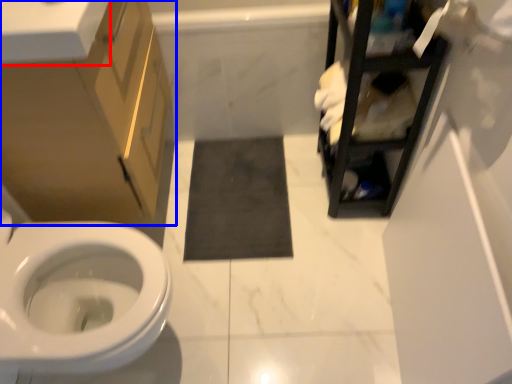
Question: Among these objects, which one is nearest to the camera, counter top (highlighted by a red box) or bathroom cabinet (highlighted by a blue box)?

Choices:
 (A) counter top
 (B) bathroom cabinet

Answer: (A)